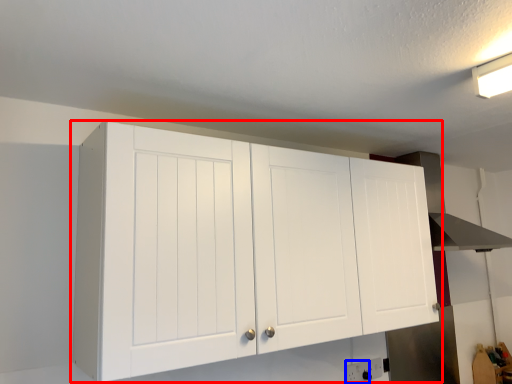
Question: Among these objects, which one is farthest to the camera, cupboard (highlighted by a red box) or electric outlet (highlighted by a blue box)?

Choices:
 (A) cupboard
 (B) electric outlet

Answer: (B)